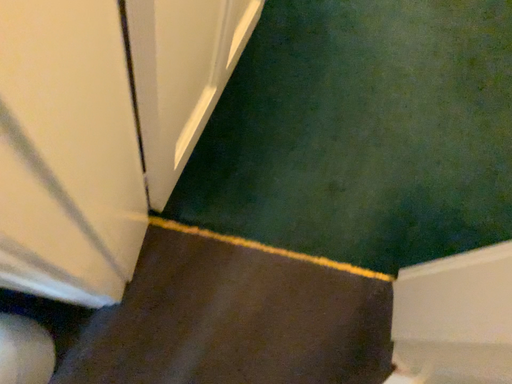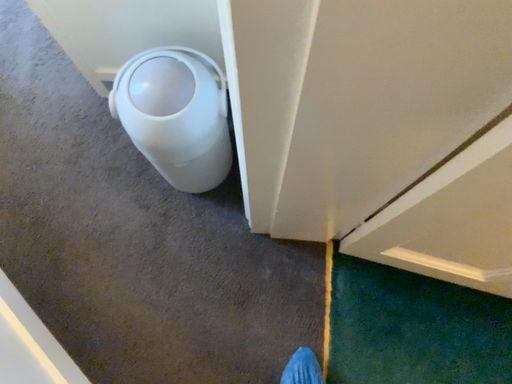
Question: How did the camera likely rotate when shooting the video?

Choices:
 (A) rotated left
 (B) rotated right

Answer: (A)